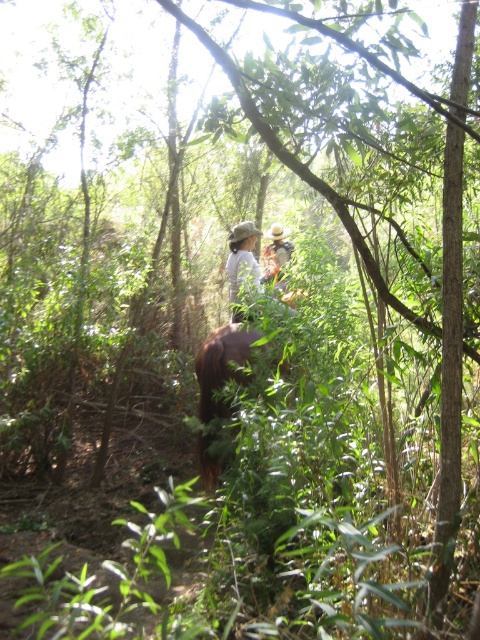
Question: Which object is positioned farthest from the brown furry horse at center?

Choices:
 (A) wooden hat at center
 (B) light brown fabric at center

Answer: (A)

Question: Estimate the real-world distances between objects in this image. Which object is closer to the light brown fabric at center?

Choices:
 (A) wooden hat at center
 (B) brown furry horse at center

Answer: (A)

Question: Can you confirm if light brown fabric at center is smaller than wooden hat at center?

Choices:
 (A) no
 (B) yes

Answer: (A)

Question: Among these points, which one is nearest to the camera?

Choices:
 (A) (287, 248)
 (B) (272, 236)
 (C) (210, 440)

Answer: (C)

Question: Can you confirm if brown furry horse at center is positioned to the right of wooden hat at center?

Choices:
 (A) no
 (B) yes

Answer: (A)

Question: Is light brown fabric at center closer to the viewer compared to wooden hat at center?

Choices:
 (A) yes
 (B) no

Answer: (A)